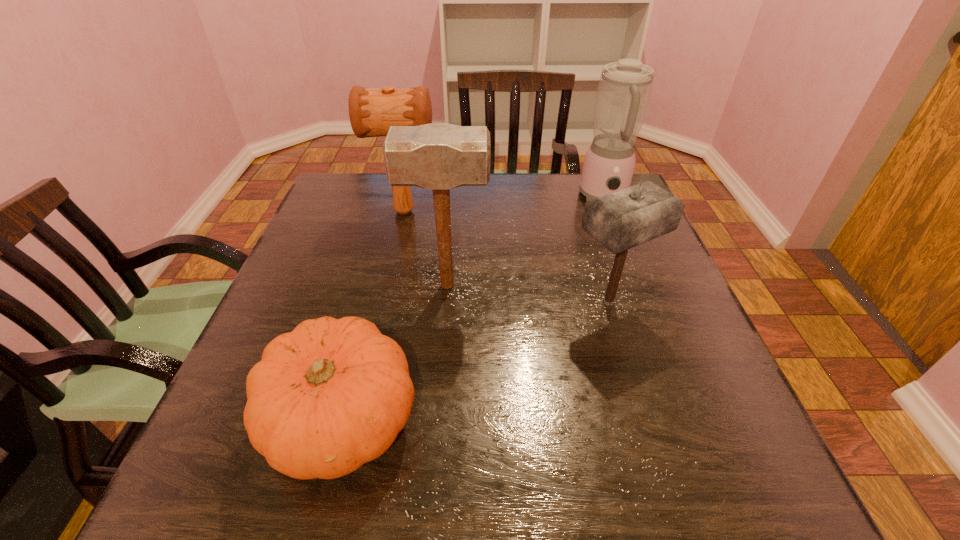
Identify the location of mallet that is at the far edge. Image resolution: width=960 pixels, height=540 pixels. (372, 111).

Locate an element on the screen. This screenshot has height=540, width=960. object present at the near edge is located at coordinates (333, 394).

Identify the location of mallet located in the left edge section of the desktop. (372, 111).

Find the location of a particular element. The height and width of the screenshot is (540, 960). pumpkin located at the left edge is located at coordinates (333, 394).

You are a GUI agent. You are given a task and a screenshot of the screen. Output one action in this format:
    pyautogui.click(x=<x>, y=<y>)
    Task: Click on the food processor located at the right edge
    The image size is (960, 540).
    Given the screenshot: What is the action you would take?
    pyautogui.click(x=624, y=90)

Where is `mallet present at the right edge`? This screenshot has width=960, height=540. mallet present at the right edge is located at coordinates (621, 220).

The image size is (960, 540). In order to click on object positioned at the far left corner in this screenshot , I will do `click(372, 111)`.

The width and height of the screenshot is (960, 540). Find the location of `object at the near left corner`. object at the near left corner is located at coordinates (333, 394).

Locate an element on the screen. object that is positioned at the far right corner is located at coordinates (624, 90).

In the image, there is a desktop. At what (x,y) coordinates should I click in order to perform the action: click on vacant space at the far edge. Please return your answer as a coordinate pair (x, y). The height and width of the screenshot is (540, 960). Looking at the image, I should click on (538, 180).